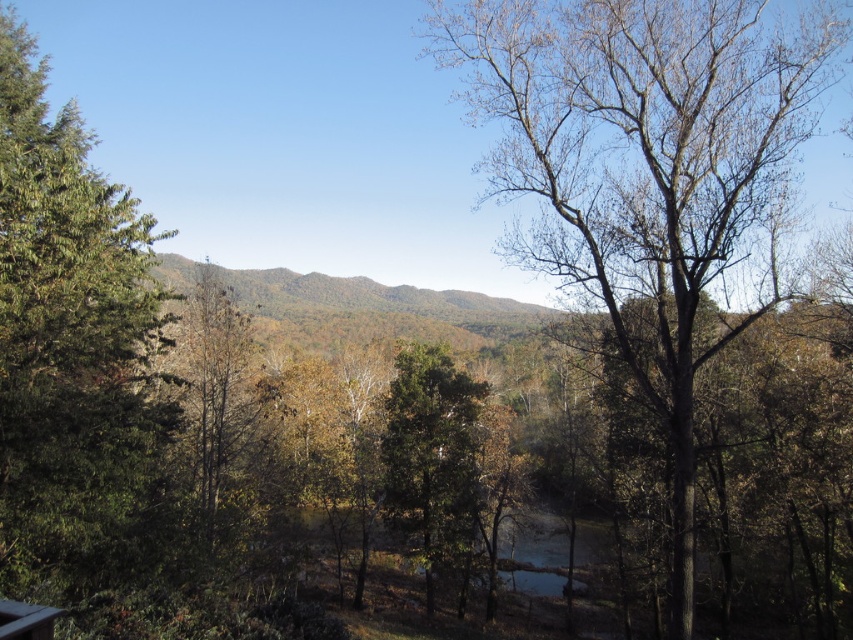
Who is more forward, (596, 173) or (143, 312)?

Point (143, 312) is in front.

Measure the distance from bare wood tree at center to green leafy tree at left.

60.78 feet

This screenshot has height=640, width=853. Identify the location of bare wood tree at center. (643, 170).

You are a GUI agent. You are given a task and a screenshot of the screen. Output one action in this format:
    pyautogui.click(x=<x>, y=<y>)
    Task: Click on the bare wood tree at center
    The image size is (853, 640).
    Given the screenshot: What is the action you would take?
    pyautogui.click(x=643, y=170)

The width and height of the screenshot is (853, 640). Find the location of `green matte tree at center`. green matte tree at center is located at coordinates (433, 454).

Is point (415, 525) closer to viewer compared to point (15, 602)?

No, (415, 525) is behind (15, 602).

Between point (444, 490) and point (24, 602), which one is positioned in front?

Positioned in front is point (24, 602).

The height and width of the screenshot is (640, 853). What are the coordinates of `green matte tree at center` in the screenshot? It's located at (433, 454).

Can you confirm if bare wood tree at center is positioned above white wood deck at lower left?

Correct, bare wood tree at center is located above white wood deck at lower left.

Who is taller, bare wood tree at center or white wood deck at lower left?

Standing taller between the two is bare wood tree at center.

Identify the location of bare wood tree at center. (643, 170).